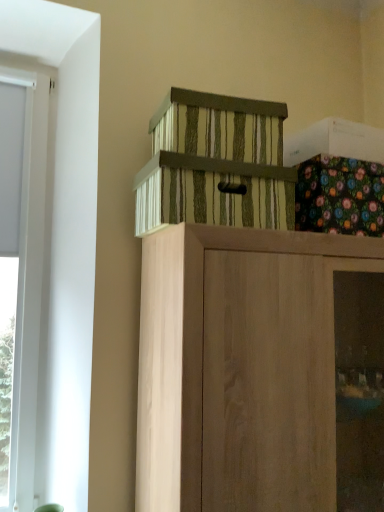
Question: Considering the positions of wooden cabinet at center, positioned as the 1th cabinetry in bottom-to-top order, and floral fabric box at upper right in the image, is wooden cabinet at center, positioned as the 1th cabinetry in bottom-to-top order, taller or shorter than floral fabric box at upper right?

Choices:
 (A) short
 (B) tall

Answer: (B)

Question: Does point (266, 301) appear closer or farther from the camera than point (355, 159)?

Choices:
 (A) farther
 (B) closer

Answer: (B)

Question: Which is farther from the wooden cabinet at center, which ranks as the second cabinetry in top-to-bottom order?

Choices:
 (A) floral fabric box at upper right
 (B) striped cardboard box at upper center, arranged as the first cabinetry when viewed from the top

Answer: (A)

Question: Which object is the closest to the floral fabric box at upper right?

Choices:
 (A) wooden cabinet at center, which ranks as the second cabinetry in top-to-bottom order
 (B) striped cardboard box at upper center, arranged as the first cabinetry when viewed from the top

Answer: (B)